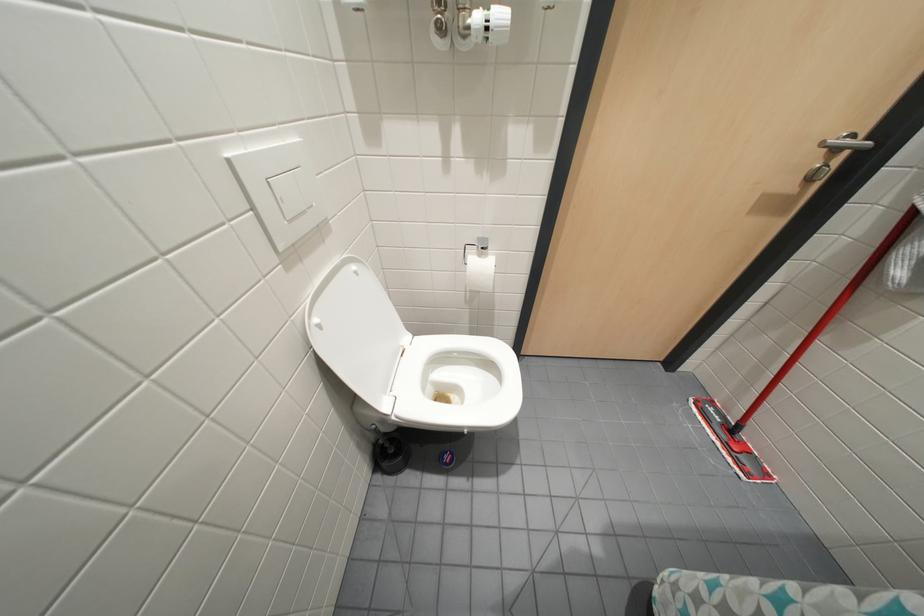
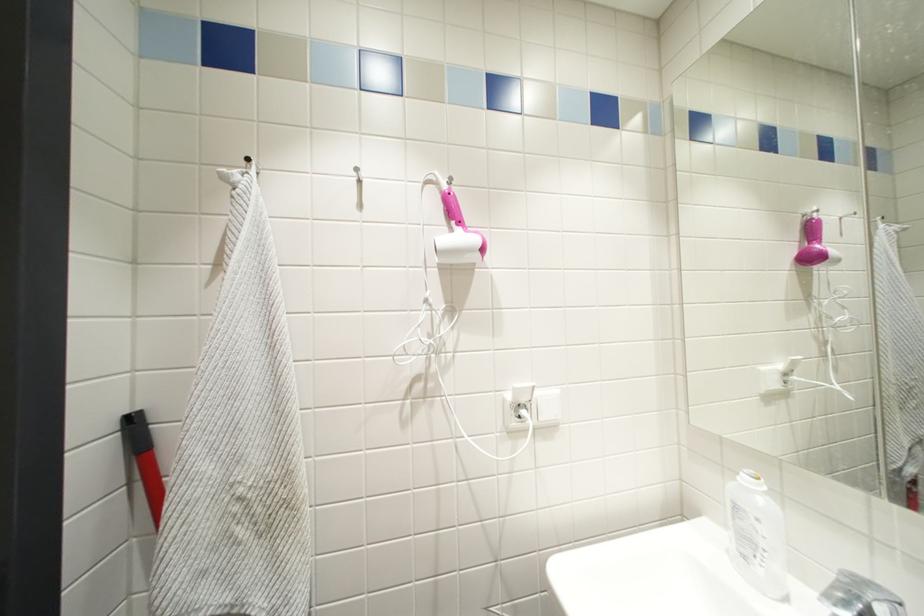
Question: Based on the continuous images, in which direction is the camera rotating? Reply with the corresponding letter.

Choices:
 (A) Left
 (B) Right
 (C) Up
 (D) Down

Answer: (B)